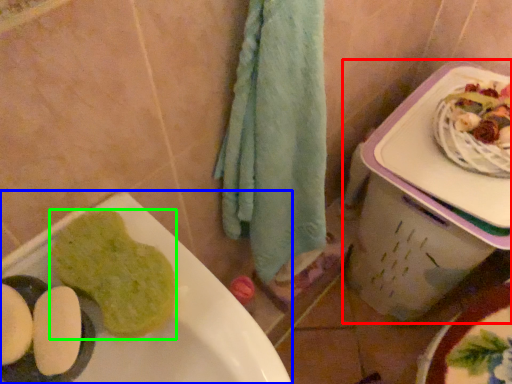
Question: Estimate the real-world distances between objects in this image. Which object is farther from lunch box (highlighted by a red box), sink (highlighted by a blue box) or food (highlighted by a green box)?

Choices:
 (A) sink
 (B) food

Answer: (B)